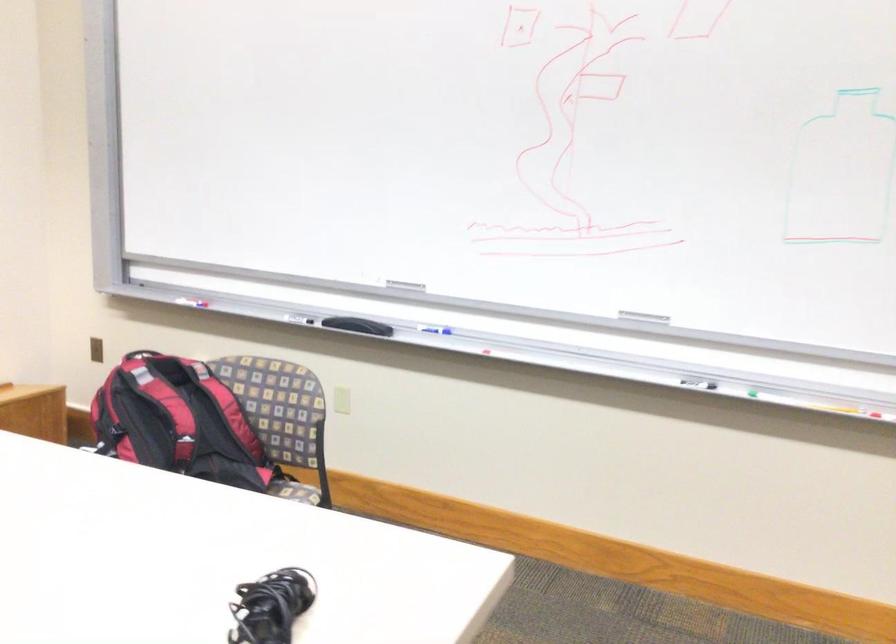
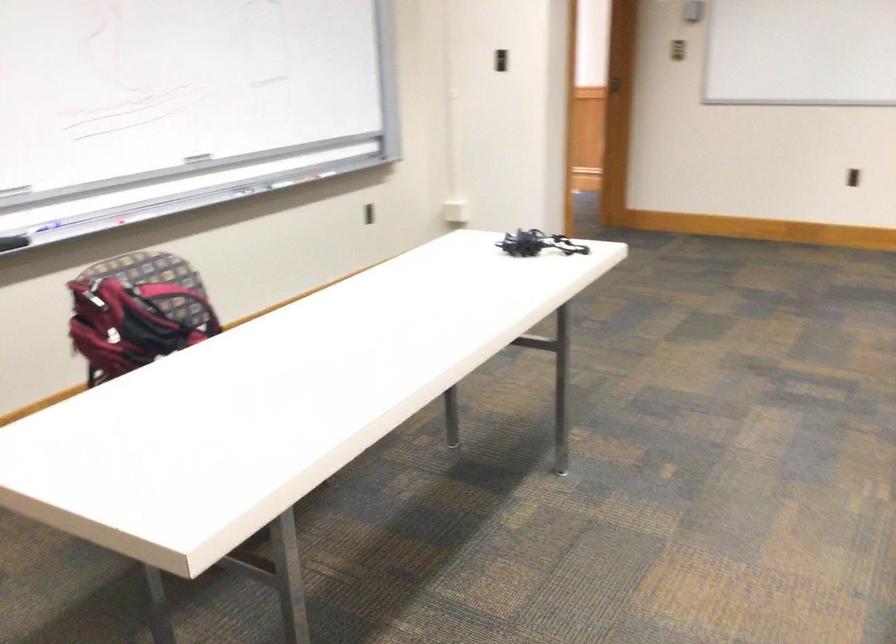
Locate, in the second image, the point that corresponds to point 419,328 in the first image.

(39, 229)